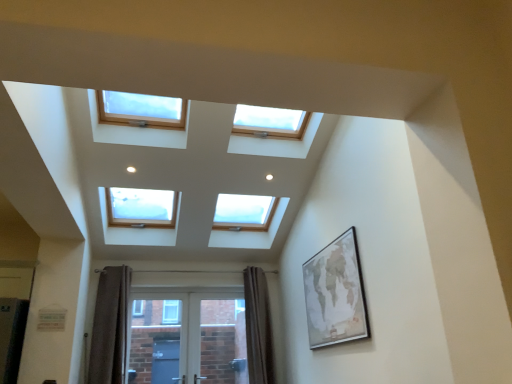
Question: In terms of height, does wooden-framed map at right look taller or shorter compared to brown textured curtain at lower center, which ranks as the first curtain in right-to-left order?

Choices:
 (A) tall
 (B) short

Answer: (B)

Question: From a real-world perspective, is wooden-framed map at right physically located above or below brown textured curtain at lower center, marked as the 2th curtain in a left-to-right arrangement?

Choices:
 (A) above
 (B) below

Answer: (A)

Question: Which is farther from the brown velvet curtain at lower left, acting as the 1th curtain starting from the left?

Choices:
 (A) brown textured curtain at lower center, marked as the 2th curtain in a left-to-right arrangement
 (B) white glossy screen door at lower center
 (C) wooden-framed map at right

Answer: (C)

Question: Which of these objects is positioned farthest from the brown textured curtain at lower center, which ranks as the first curtain in right-to-left order?

Choices:
 (A) white glossy screen door at lower center
 (B) brown velvet curtain at lower left, acting as the 1th curtain starting from the left
 (C) wooden-framed map at right

Answer: (C)